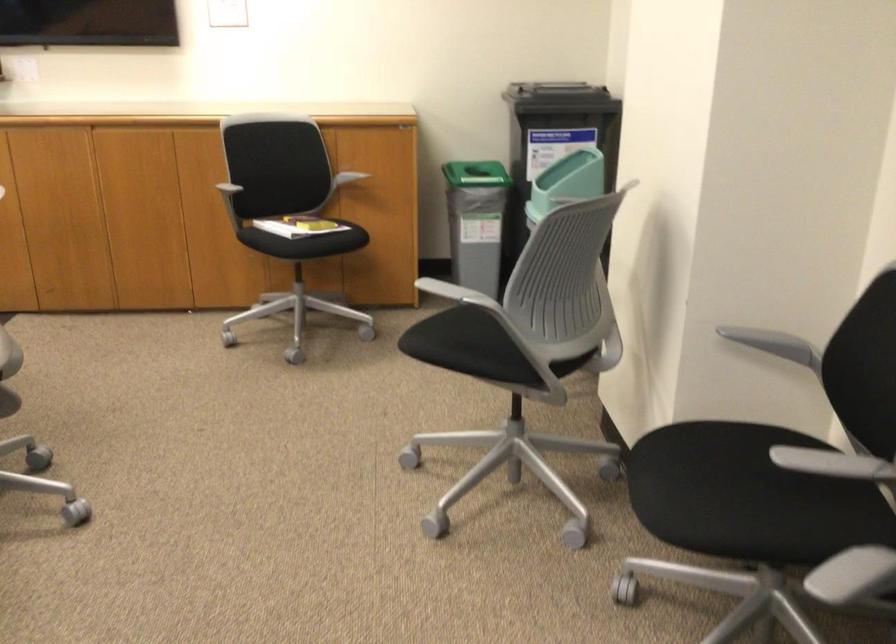
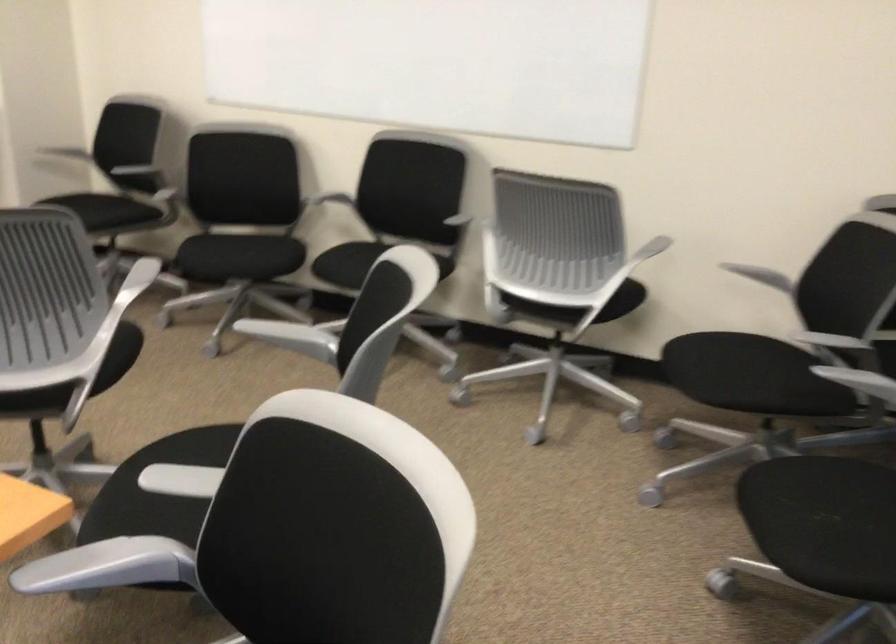
Find the pixel in the second image that matches (708,514) in the first image.

(97, 213)